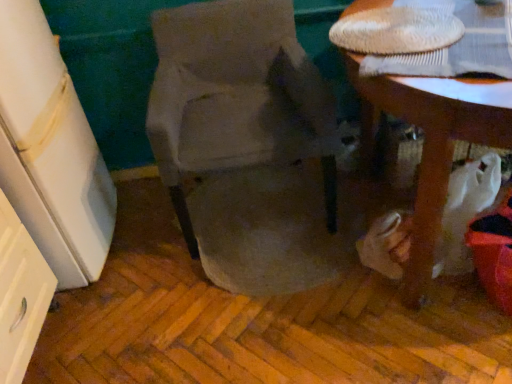
The height and width of the screenshot is (384, 512). What are the coordinates of `suede-like beige chair at center` in the screenshot? It's located at (236, 97).

Is suede-like beige chair at center at the left side of white glossy drawer at left?

No, suede-like beige chair at center is not to the left of white glossy drawer at left.

In the image, is suede-like beige chair at center positioned in front of or behind white glossy drawer at left?

Clearly, suede-like beige chair at center is behind white glossy drawer at left.

Where is `leftover on the left of suede-like beige chair at center`? leftover on the left of suede-like beige chair at center is located at coordinates (51, 151).

Is suede-like beige chair at center with white glossy drawer at left?

There is a gap between suede-like beige chair at center and white glossy drawer at left.

How many degrees apart are the facing directions of wooden table at lower right and white glossy drawer at left?

wooden table at lower right and white glossy drawer at left are facing 97.4 degrees away from each other.

Is point (416, 108) closer or farther from the camera than point (5, 6)?

Clearly, point (416, 108) is closer to the camera than point (5, 6).

In terms of width, does wooden table at lower right look wider or thinner when compared to white glossy drawer at left?

Clearly, wooden table at lower right has more width compared to white glossy drawer at left.

Is wooden table at lower right far away from white glossy drawer at left?

Yes, wooden table at lower right is far from white glossy drawer at left.

Is white glossy drawer at left positioned beyond the bounds of suede-like beige chair at center?

Yes.

Is white glossy drawer at left in contact with suede-like beige chair at center?

No.

From a real-world perspective, relative to suede-like beige chair at center, is white glossy drawer at left vertically above or below?

Clearly, from a real-world perspective, white glossy drawer at left is above suede-like beige chair at center.

Is white glossy drawer at left to the left or to the right of suede-like beige chair at center in the image?

Based on their positions, white glossy drawer at left is located to the left of suede-like beige chair at center.

Is wooden table at lower right outside of suede-like beige chair at center?

That's correct, wooden table at lower right is outside of suede-like beige chair at center.

Who is smaller, wooden table at lower right or suede-like beige chair at center?

suede-like beige chair at center.

Considering the positions of objects wooden table at lower right and suede-like beige chair at center in the image provided, who is more to the left, wooden table at lower right or suede-like beige chair at center?

suede-like beige chair at center.

From the image's perspective, is white glossy drawer at left below wooden table at lower right?

Correct, white glossy drawer at left appears lower than wooden table at lower right in the image.

Is white glossy drawer at left placed right next to wooden table at lower right?

No, white glossy drawer at left is not next to wooden table at lower right.

From a real-world perspective, which object stands above the other?

white glossy drawer at left, from a real-world perspective.

Considering the sizes of objects suede-like beige chair at center and wooden table at lower right in the image provided, who is wider, suede-like beige chair at center or wooden table at lower right?

Wider between the two is wooden table at lower right.

Is suede-like beige chair at center far away from wooden table at lower right?

No, suede-like beige chair at center is in close proximity to wooden table at lower right.

From the picture: Can wooden table at lower right be found inside suede-like beige chair at center?

No, suede-like beige chair at center does not contain wooden table at lower right.

Is suede-like beige chair at center bigger or smaller than wooden table at lower right?

Clearly, suede-like beige chair at center is smaller in size than wooden table at lower right.

At what (x,y) coordinates should I click in order to perform the action: click on chair below the white glossy drawer at left (from a real-world perspective). Please return your answer as a coordinate pair (x, y). The image size is (512, 384). Looking at the image, I should click on (236, 97).

You are a GUI agent. You are given a task and a screenshot of the screen. Output one action in this format:
    pyautogui.click(x=<x>, y=<y>)
    Task: Click on the leftover below the wooden table at lower right (from the image's perspective)
    
    Given the screenshot: What is the action you would take?
    pyautogui.click(x=51, y=151)

Considering their positions, is suede-like beige chair at center positioned closer to white glossy drawer at left than wooden table at lower right?

Among the two, suede-like beige chair at center is located nearer to white glossy drawer at left.

Considering their positions, is wooden table at lower right positioned closer to suede-like beige chair at center than white glossy drawer at left?

Among the two, white glossy drawer at left is located nearer to suede-like beige chair at center.

Considering their positions, is suede-like beige chair at center positioned further to wooden table at lower right than white glossy drawer at left?

white glossy drawer at left.

When comparing their distances from wooden table at lower right, does white glossy drawer at left or suede-like beige chair at center seem further?

Based on the image, white glossy drawer at left appears to be further to wooden table at lower right.

Looking at the image, which one is located closer to white glossy drawer at left, wooden table at lower right or suede-like beige chair at center?

Based on the image, suede-like beige chair at center appears to be nearer to white glossy drawer at left.

Which object lies further to the anchor point suede-like beige chair at center, white glossy drawer at left or wooden table at lower right?

wooden table at lower right is further to suede-like beige chair at center.

The image size is (512, 384). Find the location of `chair between white glossy drawer at left and wooden table at lower right in the horizontal direction`. chair between white glossy drawer at left and wooden table at lower right in the horizontal direction is located at coordinates (x=236, y=97).